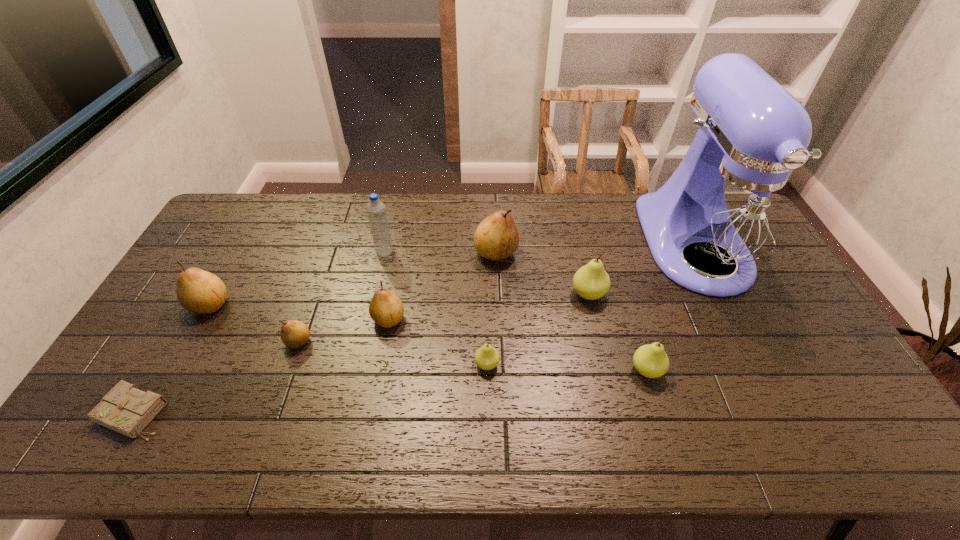
Find the location of a particular element. This screenshot has width=960, height=540. the rightmost pear is located at coordinates (650, 360).

This screenshot has height=540, width=960. Identify the location of the second smallest brown pear. (386, 309).

Identify the location of the fifth pear from right to left. The width and height of the screenshot is (960, 540). (386, 309).

Locate an element on the screen. Image resolution: width=960 pixels, height=540 pixels. the smallest green pear is located at coordinates (487, 357).

At what (x,y) coordinates should I click in order to perform the action: click on the second pear from left to right. Please return your answer as a coordinate pair (x, y). Looking at the image, I should click on (294, 334).

You are a GUI agent. You are given a task and a screenshot of the screen. Output one action in this format:
    pyautogui.click(x=<x>, y=<y>)
    Task: Click on the smallest brown pear
    
    Given the screenshot: What is the action you would take?
    pyautogui.click(x=294, y=334)

Find the location of a particular element. The image size is (960, 540). the shortest object is located at coordinates (126, 409).

I want to click on the nearest object, so click(x=126, y=409).

Find the location of a particular element. Image resolution: width=960 pixels, height=540 pixels. free space located at the mixing area of the mixer is located at coordinates (747, 347).

Identify the location of vacant space located 0.350m on the left of the water bottle. Image resolution: width=960 pixels, height=540 pixels. (273, 251).